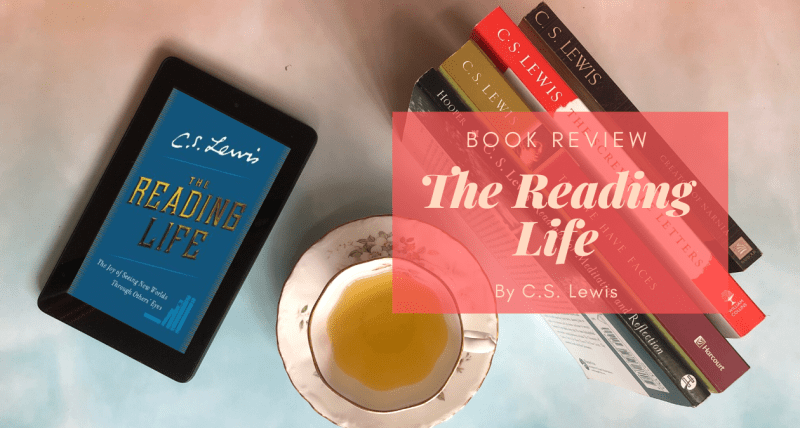
The image size is (800, 428). What are the coordinates of `saucer` in the screenshot? It's located at (473, 395).